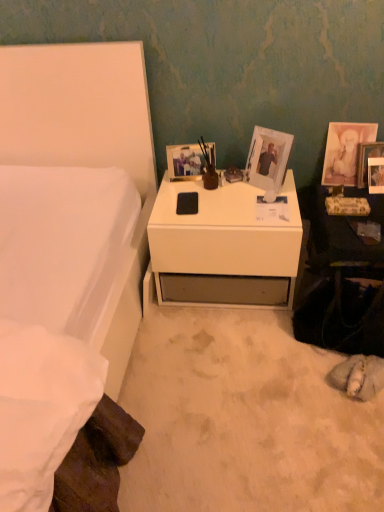
Question: Does green floral magazine at right lie in front of matte white picture frame at upper right, the 3th picture frame from the left?

Choices:
 (A) yes
 (B) no

Answer: (A)

Question: Is green floral magazine at right not near matte white picture frame at upper right, the 3th picture frame from the left?

Choices:
 (A) yes
 (B) no

Answer: (B)

Question: Is green floral magazine at right positioned behind matte white picture frame at upper right, acting as the second picture frame starting from the right?

Choices:
 (A) no
 (B) yes

Answer: (A)

Question: Considering the relative sizes of green floral magazine at right and matte white picture frame at upper right, the 3th picture frame from the left, in the image provided, is green floral magazine at right smaller than matte white picture frame at upper right, the 3th picture frame from the left,?

Choices:
 (A) yes
 (B) no

Answer: (A)

Question: From the image's perspective, would you say green floral magazine at right is shown under matte white picture frame at upper right, the 3th picture frame from the left?

Choices:
 (A) yes
 (B) no

Answer: (A)

Question: From a real-world perspective, is green floral magazine at right positioned under matte white picture frame at upper right, acting as the second picture frame starting from the right, based on gravity?

Choices:
 (A) yes
 (B) no

Answer: (A)

Question: Can you confirm if white matte bed at left is smaller than matte white picture frame at upper right, the 4th picture frame in the left-to-right sequence?

Choices:
 (A) yes
 (B) no

Answer: (B)

Question: From a real-world perspective, is white matte bed at left under matte white picture frame at upper right, the 4th picture frame in the left-to-right sequence?

Choices:
 (A) yes
 (B) no

Answer: (B)

Question: Does white matte bed at left have a larger size compared to matte white picture frame at upper right, the 4th picture frame in the left-to-right sequence?

Choices:
 (A) yes
 (B) no

Answer: (A)

Question: From a real-world perspective, is white matte bed at left over matte white picture frame at upper right, the 4th picture frame in the left-to-right sequence?

Choices:
 (A) no
 (B) yes

Answer: (B)

Question: Considering the relative positions of white matte bed at left and matte white picture frame at upper right, acting as the 1th picture frame starting from the right, in the image provided, is white matte bed at left to the left of matte white picture frame at upper right, acting as the 1th picture frame starting from the right, from the viewer's perspective?

Choices:
 (A) yes
 (B) no

Answer: (A)

Question: Is white matte bed at left positioned behind matte white picture frame at upper right, the 4th picture frame in the left-to-right sequence?

Choices:
 (A) yes
 (B) no

Answer: (B)

Question: Can you confirm if white matte bed at left is wider than matte white picture frame at upper right, acting as the second picture frame starting from the right?

Choices:
 (A) yes
 (B) no

Answer: (A)